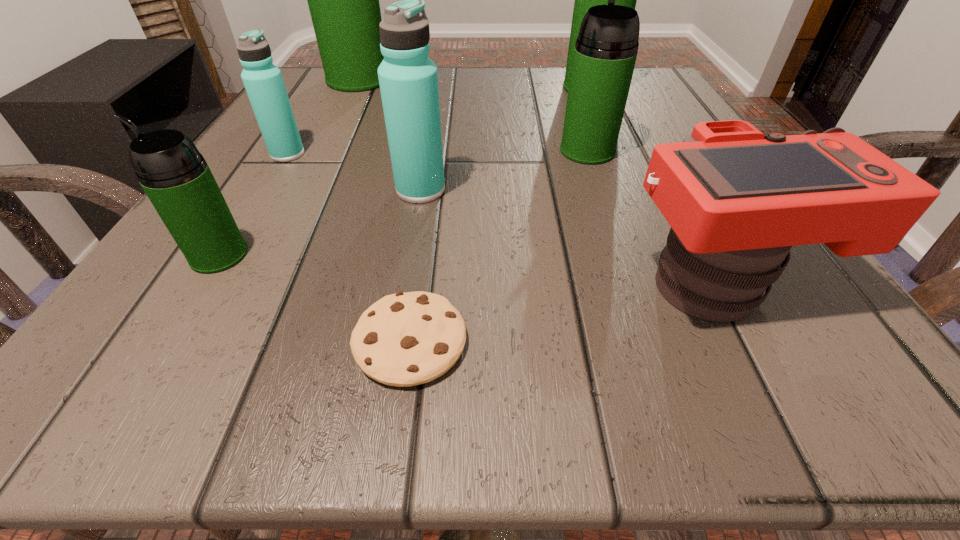
In order to click on vacant space in between the third biggest green thermos bottle and the tallest thermos bottle in this screenshot , I will do `click(473, 115)`.

Locate an element on the screen. This screenshot has width=960, height=540. vacant area between the second nearest green thermos bottle and the smallest green thermos bottle is located at coordinates (403, 203).

The height and width of the screenshot is (540, 960). Find the location of `vacant space that's between the bigger aqua thermos bottle and the smallest green thermos bottle`. vacant space that's between the bigger aqua thermos bottle and the smallest green thermos bottle is located at coordinates (320, 222).

At what (x,y) coordinates should I click in order to perform the action: click on unoccupied area between the farther aqua thermos bottle and the bigger aqua thermos bottle. Please return your answer as a coordinate pair (x, y). The height and width of the screenshot is (540, 960). Looking at the image, I should click on (354, 172).

You are a GUI agent. You are given a task and a screenshot of the screen. Output one action in this format:
    pyautogui.click(x=<x>, y=<y>)
    Task: Click on the vacant point located between the camera and the right aqua thermos bottle
    Image resolution: width=960 pixels, height=540 pixels.
    Given the screenshot: What is the action you would take?
    pyautogui.click(x=570, y=235)

You are a GUI agent. You are given a task and a screenshot of the screen. Output one action in this format:
    pyautogui.click(x=<x>, y=<y>)
    Task: Click on the free space that is in between the nearest thermos bottle and the biggest green thermos bottle
    
    Given the screenshot: What is the action you would take?
    pyautogui.click(x=289, y=167)

I want to click on object that is the closest to the shortest object, so click(x=175, y=176).

Select which object appears as the fourth closest to the tallest object. Please provide its 2D coordinates. Your answer should be formatted as a tuple, i.e. [(x, y)], where the tuple contains the x and y coordinates of a point satisfying the conditions above.

[(606, 48)]

Choose which thermos bottle is the fourth nearest neighbor to the brown cookie. Please provide its 2D coordinates. Your answer should be formatted as a tuple, i.e. [(x, y)], where the tuple contains the x and y coordinates of a point satisfying the conditions above.

[(263, 81)]

At what (x,y) coordinates should I click in order to perform the action: click on thermos bottle that is the fourth closest to the camera. Please return your answer as a coordinate pair (x, y). The height and width of the screenshot is (540, 960). Looking at the image, I should click on (175, 176).